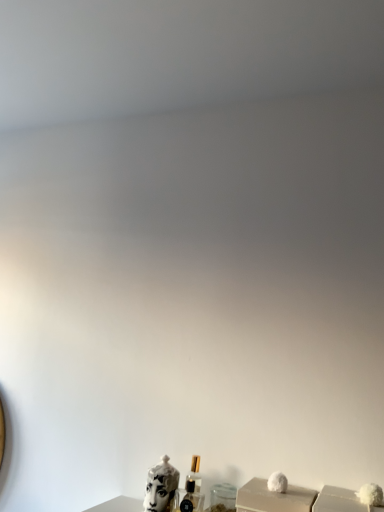
Locate an element on the screen. This screenshot has height=512, width=384. white matte box at lower right is located at coordinates (273, 498).

From the picture: What is the approximate width of white matte box at lower right?

It is 6.83 inches.

You are a GUI agent. You are given a task and a screenshot of the screen. Output one action in this format:
    pyautogui.click(x=<x>, y=<y>)
    Task: Click on the clear glass perfume at center
    
    Given the screenshot: What is the action you would take?
    coord(193,489)

Where is `white matte box at lower right`? white matte box at lower right is located at coordinates (273, 498).

From a real-world perspective, between white glossy sculpture at lower center and clear glass perfume at center, who is vertically higher?

clear glass perfume at center, from a real-world perspective.

From the image's perspective, does white glossy sculpture at lower center appear lower than clear glass perfume at center?

No, from the image's perspective, white glossy sculpture at lower center is not beneath clear glass perfume at center.

From their relative heights in the image, would you say white glossy sculpture at lower center is taller or shorter than clear glass perfume at center?

white glossy sculpture at lower center is shorter than clear glass perfume at center.

Considering the positions of objects white glossy sculpture at lower center and clear glass perfume at center in the image provided, who is more to the left, white glossy sculpture at lower center or clear glass perfume at center?

From the viewer's perspective, white glossy sculpture at lower center appears more on the left side.

Is clear glass perfume at center touching white matte box at lower right?

No, clear glass perfume at center is not making contact with white matte box at lower right.

Which object is closer to the camera, clear glass perfume at center or white matte box at lower right?

white matte box at lower right.

I want to click on perfume behind the white matte box at lower right, so click(x=193, y=489).

Considering the sizes of objects clear glass perfume at center and white matte box at lower right in the image provided, who is taller, clear glass perfume at center or white matte box at lower right?

Standing taller between the two is white matte box at lower right.

Measure the distance from white glossy sculpture at lower center to white matte box at lower right.

23.59 centimeters.

Is white glossy sculpture at lower center far away from white matte box at lower right?

Actually, white glossy sculpture at lower center and white matte box at lower right are a little close together.

Is white glossy sculpture at lower center surrounding white matte box at lower right?

Actually, white matte box at lower right is outside white glossy sculpture at lower center.

You are a GUI agent. You are given a task and a screenshot of the screen. Output one action in this format:
    pyautogui.click(x=<x>, y=<y>)
    Task: Click on the box below the white glossy sculpture at lower center (from the image's perspective)
    The image size is (384, 512).
    Given the screenshot: What is the action you would take?
    pyautogui.click(x=273, y=498)

Is white glossy sculpture at lower center at the back of white matte box at lower right?

No, white glossy sculpture at lower center is not at the back of white matte box at lower right.

From a real-world perspective, is white matte box at lower right positioned over white glossy sculpture at lower center based on gravity?

Yes, from a real-world perspective, white matte box at lower right is on top of white glossy sculpture at lower center.

Is white matte box at lower right smaller than white glossy sculpture at lower center?

No.

From the image's perspective, between white matte box at lower right and white glossy sculpture at lower center, who is located below?

From the image's view, white matte box at lower right is below.

From a real-world perspective, which object stands above the other?

white matte box at lower right, from a real-world perspective.

Which object is more forward, white matte box at lower right or clear glass perfume at center?

white matte box at lower right is in front.

Is white matte box at lower right smaller than clear glass perfume at center?

No, white matte box at lower right is not smaller than clear glass perfume at center.

Which is behind, point (239, 496) or point (181, 502)?

The point (181, 502) is behind.

Considering the positions of objects clear glass perfume at center and white glossy sculpture at lower center in the image provided, who is more to the left, clear glass perfume at center or white glossy sculpture at lower center?

white glossy sculpture at lower center.

Does clear glass perfume at center lie in front of white glossy sculpture at lower center?

No, it is not.

Can you tell me how much clear glass perfume at center and white glossy sculpture at lower center differ in facing direction?

0.91 degrees.

Is clear glass perfume at center not within white glossy sculpture at lower center?

Yes, clear glass perfume at center is located beyond the bounds of white glossy sculpture at lower center.

Image resolution: width=384 pixels, height=512 pixels. I want to click on animal in front of the clear glass perfume at center, so click(x=160, y=486).

I want to click on perfume below the white matte box at lower right (from a real-world perspective), so click(193, 489).

Considering their positions, is white matte box at lower right positioned further to white glossy sculpture at lower center than clear glass perfume at center?

white matte box at lower right.

When comparing their distances from clear glass perfume at center, does white matte box at lower right or white glossy sculpture at lower center seem closer?

Among the two, white glossy sculpture at lower center is located nearer to clear glass perfume at center.

Looking at the image, which one is located closer to clear glass perfume at center, white glossy sculpture at lower center or white matte box at lower right?

white glossy sculpture at lower center is closer to clear glass perfume at center.

Estimate the real-world distances between objects in this image. Which object is further from white matte box at lower right, white glossy sculpture at lower center or clear glass perfume at center?

white glossy sculpture at lower center is further to white matte box at lower right.

Which object lies nearer to the anchor point white glossy sculpture at lower center, clear glass perfume at center or white matte box at lower right?

The object closer to white glossy sculpture at lower center is clear glass perfume at center.

From the image, which object appears to be nearer to white matte box at lower right, clear glass perfume at center or white glossy sculpture at lower center?

Among the two, clear glass perfume at center is located nearer to white matte box at lower right.

At what (x,y) coordinates should I click in order to perform the action: click on perfume between white glossy sculpture at lower center and white matte box at lower right in the horizontal direction. Please return your answer as a coordinate pair (x, y). Looking at the image, I should click on (193, 489).